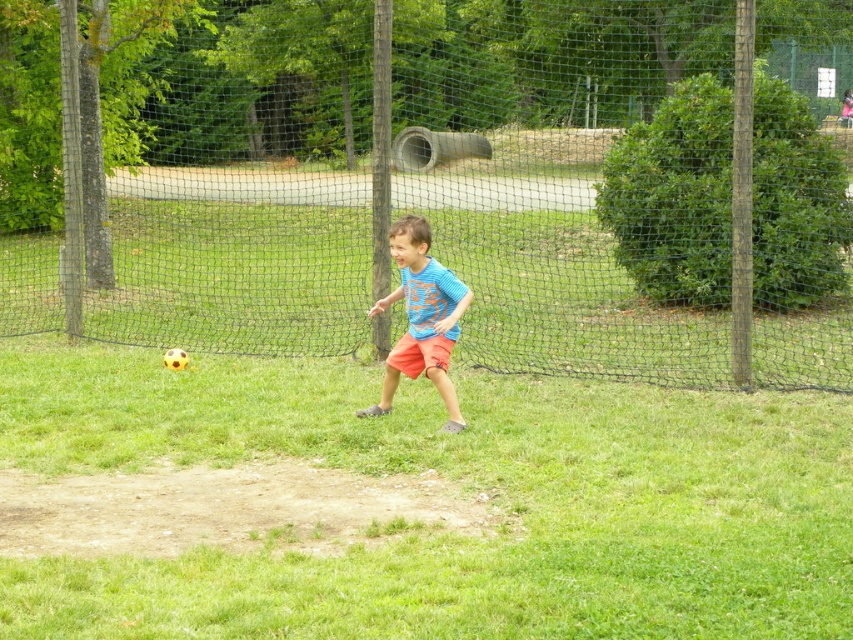
Question: Among these points, which one is farthest from the camera?

Choices:
 (A) (45, 410)
 (B) (434, 346)

Answer: (A)

Question: Which of the following is the farthest from the observer?

Choices:
 (A) (428, 339)
 (B) (373, 561)

Answer: (A)

Question: Is green grass at center below blue cotton shirt at center?

Choices:
 (A) no
 (B) yes

Answer: (B)

Question: Is green grass at center above blue cotton shirt at center?

Choices:
 (A) yes
 (B) no

Answer: (B)

Question: Is black mesh fence at center below blue cotton shirt at center?

Choices:
 (A) yes
 (B) no

Answer: (B)

Question: Which point is farther to the camera?

Choices:
 (A) (422, 234)
 (B) (730, 104)

Answer: (B)